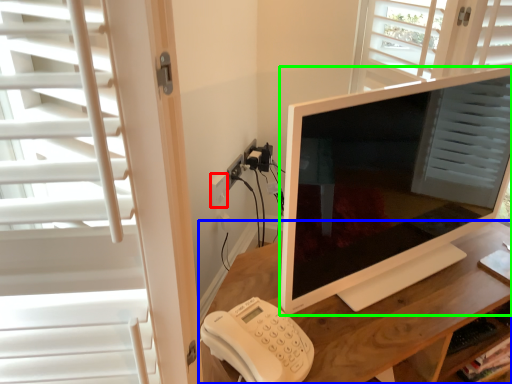
Question: Which object is positioned closest to electric outlet (highlighted by a red box)? Select from desk (highlighted by a blue box) and television (highlighted by a green box).

Choices:
 (A) desk
 (B) television

Answer: (A)